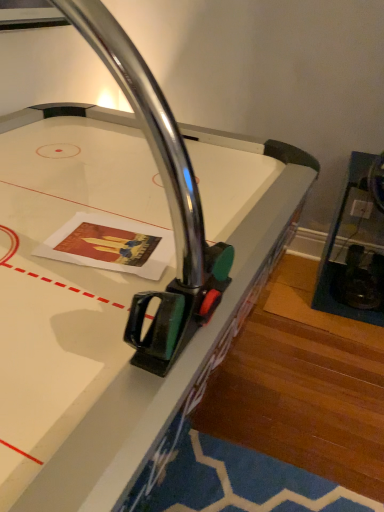
At what (x,y) coordinates should I click in order to perform the action: click on vacant area that lies in front of metallic glass shelf at right. Please return your answer as a coordinate pair (x, y). Image resolution: width=384 pixels, height=512 pixels. Looking at the image, I should click on (341, 342).